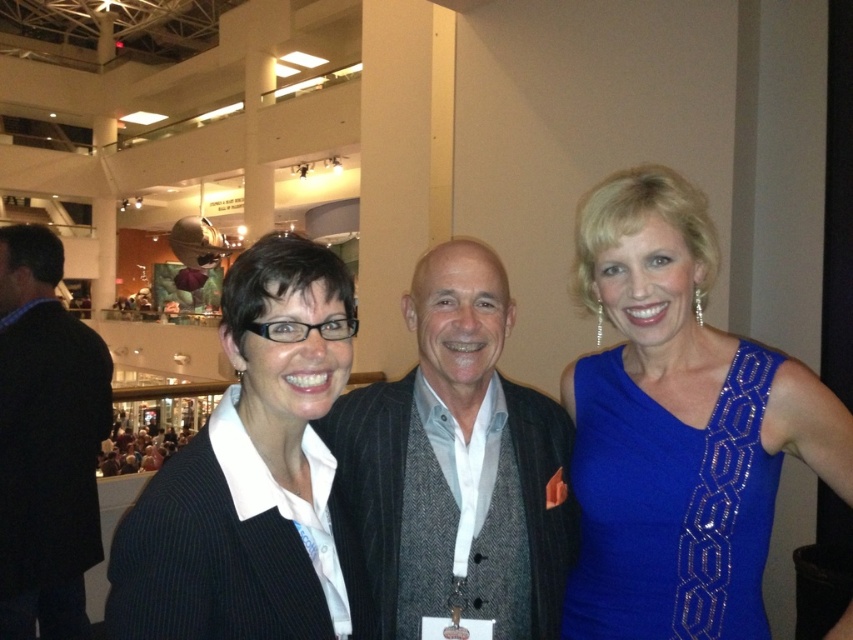
Is black pinstripe blazer at center bigger than dark gray suit at center?

Incorrect, black pinstripe blazer at center is not larger than dark gray suit at center.

Between point (244, 605) and point (90, 516), which one is positioned in front?

Point (244, 605) is more forward.

Is point (218, 548) closer to viewer compared to point (16, 372)?

Yes.

In order to click on black pinstripe blazer at center in this screenshot , I will do `click(252, 476)`.

Who is positioned more to the right, black pinstripe blazer at center or dark gray textured suit at center?

Positioned to the right is dark gray textured suit at center.

Describe the element at coordinates (252, 476) in the screenshot. I see `black pinstripe blazer at center` at that location.

Who is more distant from viewer, (328, 403) or (432, 285)?

Positioned behind is point (432, 285).

Locate an element on the screen. black pinstripe blazer at center is located at coordinates 252,476.

Measure the distance from blue sequined dress at right to black pinstripe blazer at center.

blue sequined dress at right and black pinstripe blazer at center are 24.77 inches apart from each other.

Does blue sequined dress at right have a greater width compared to black pinstripe blazer at center?

Yes.

Between point (619, 440) and point (268, 445), which one is positioned in front?

Point (268, 445)

This screenshot has height=640, width=853. Find the location of `blue sequined dress at right`. blue sequined dress at right is located at coordinates (677, 428).